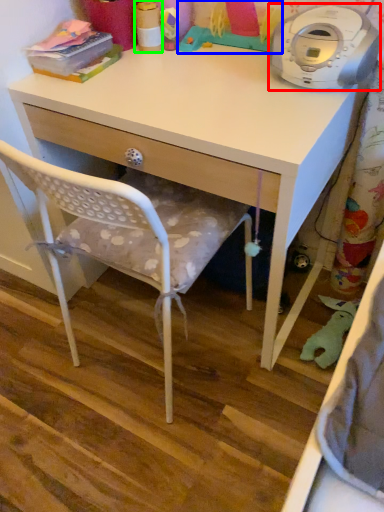
Question: Based on their relative distances, which object is farther from home appliance (highlighted by a red box)? Choose from toy (highlighted by a blue box) and toy (highlighted by a green box).

Choices:
 (A) toy
 (B) toy

Answer: (B)